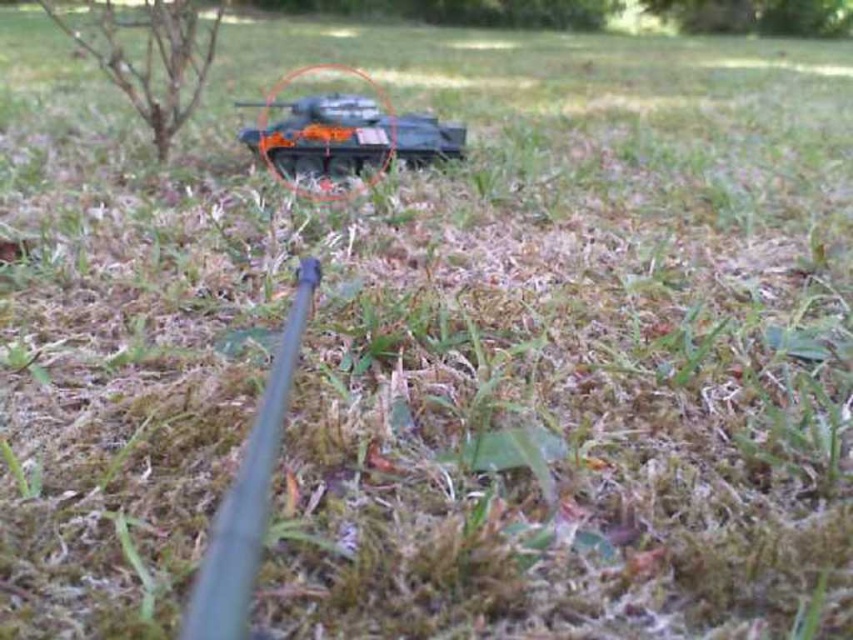
You are a photographer trying to focus on two points in the scene. The first point is at coordinate point(265, 460) and the second is at point(138, 99). Which point is closer to your camera?

Point(265, 460) is closer to the camera than point(138, 99).

You are a photographer setting up equipment for a shoot. You have an orange matte tank at center and a metallic gray gun at center in your scene. Which object should you focus on first if you want to capture the larger object in your frame?

The orange matte tank at center is bigger than the metallic gray gun at center, so you should focus on the orange matte tank at center first to capture the larger object in your frame.

You are a photographer trying to position a new camera lens in the scene. The orange matte tank at center is at point (x=344, y=132). Where should you place the lens to ensure it is exactly at the same coordinates as the orange matte tank at center?

The orange matte tank at center is located at point (x=344, y=132), so you should place the lens exactly at those coordinates to match its position.